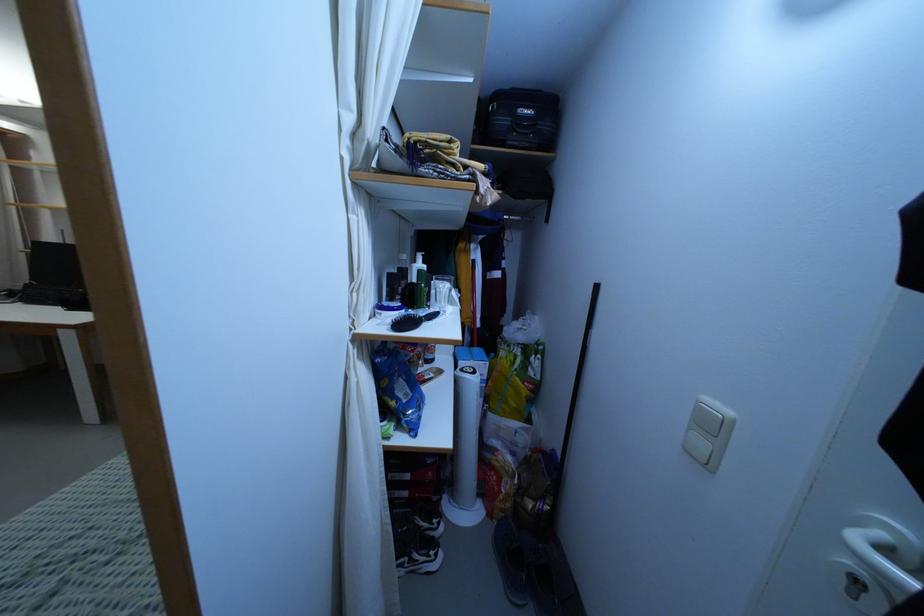
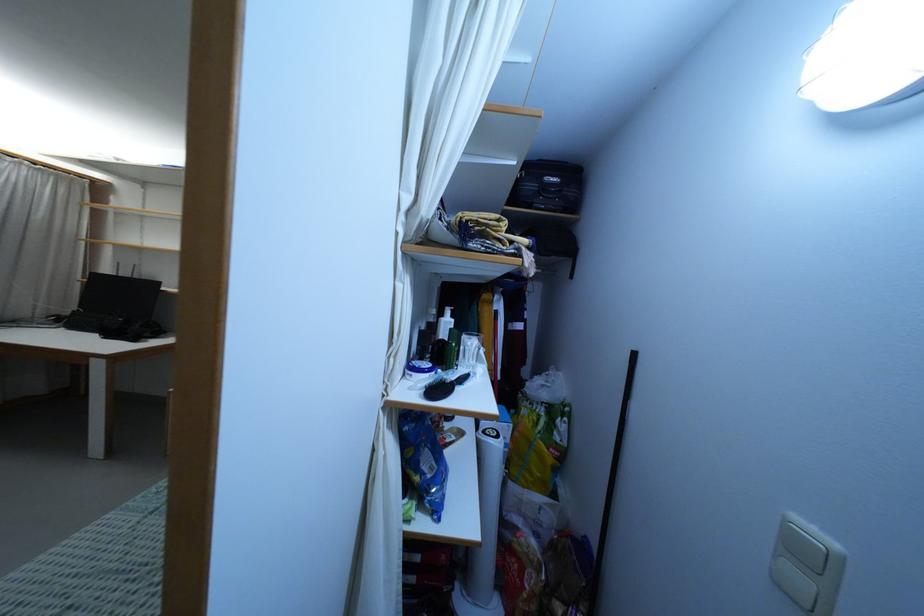
Find the pixel in the second image that matches [397,399] in the first image.

(422, 474)